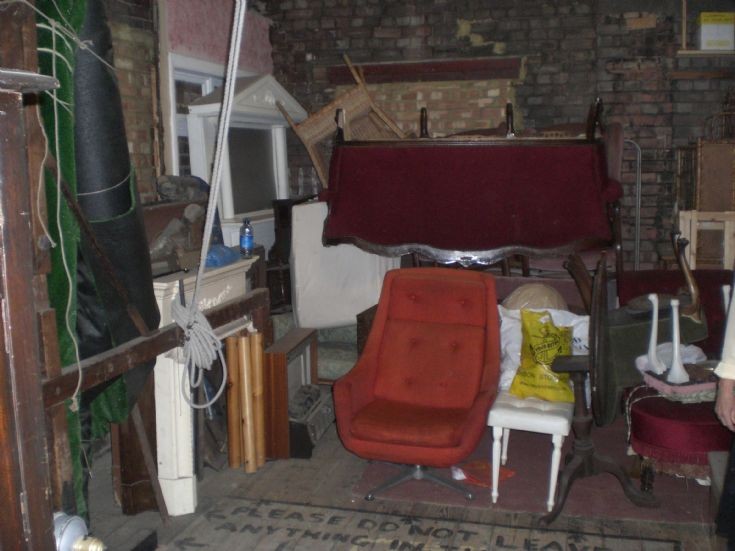
At what (x,y) coordinates should I click in order to perform the action: click on legs of maroon couch hanging upside down in the background. Please return your answer as a coordinate pair (x, y). Image resolution: width=735 pixels, height=551 pixels. Looking at the image, I should click on (336, 132), (423, 127), (514, 125), (592, 122).